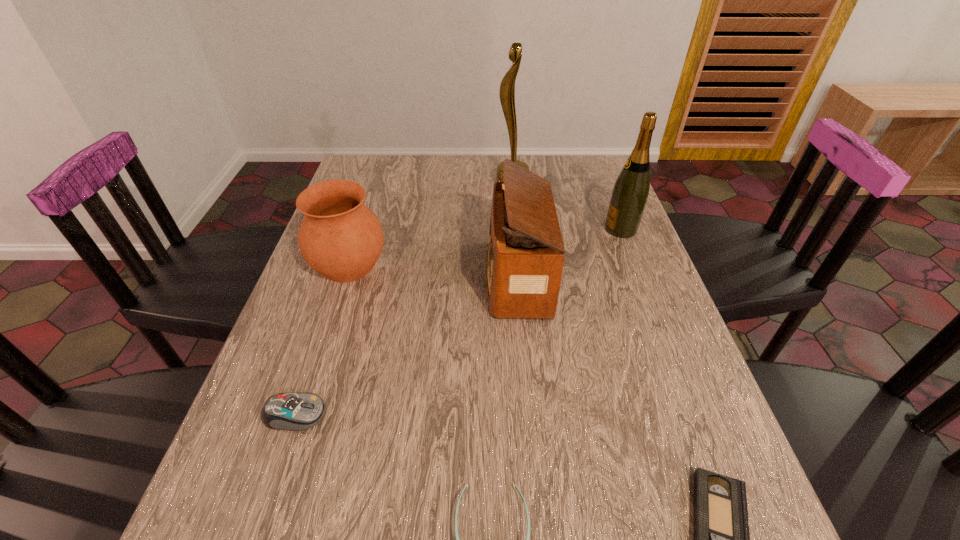
The width and height of the screenshot is (960, 540). I want to click on computer mouse that is at the left edge, so click(298, 411).

Locate an element on the screen. object that is at the right edge is located at coordinates (630, 192).

Identify the location of vacant space at the far edge of the desktop. (464, 174).

Where is `free spot at the left edge of the desktop`? free spot at the left edge of the desktop is located at coordinates (334, 298).

The image size is (960, 540). Find the location of `free region at the right edge of the desktop`. free region at the right edge of the desktop is located at coordinates (658, 287).

The height and width of the screenshot is (540, 960). In the image, there is a desktop. Identify the location of free region at the far left corner. (354, 171).

Where is `vacant space at the far right corner of the desktop`? vacant space at the far right corner of the desktop is located at coordinates (609, 191).

The height and width of the screenshot is (540, 960). Identify the location of vacant region between the fifth farthest object and the third tallest object. (406, 346).

Identify the location of empty location between the sixth shortest object and the third tallest object. The height and width of the screenshot is (540, 960). (569, 253).

Locate an element on the screen. free space between the tallest object and the pottery is located at coordinates (430, 224).